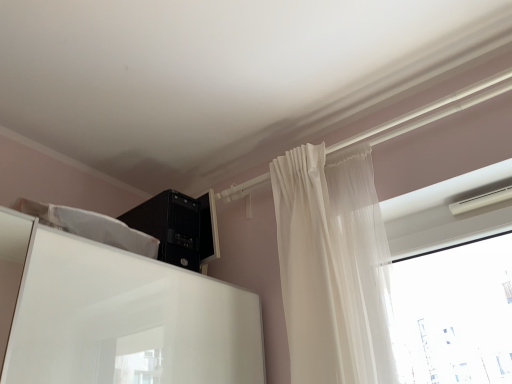
Question: Does black plastic computer tower at upper center appear on the right side of sheer white curtain at upper right?

Choices:
 (A) no
 (B) yes

Answer: (A)

Question: Is black plastic computer tower at upper center touching sheer white curtain at upper right?

Choices:
 (A) no
 (B) yes

Answer: (A)

Question: From the image's perspective, is black plastic computer tower at upper center above sheer white curtain at upper right?

Choices:
 (A) no
 (B) yes

Answer: (B)

Question: Considering the relative positions of black plastic computer tower at upper center and sheer white curtain at upper right in the image provided, is black plastic computer tower at upper center in front of sheer white curtain at upper right?

Choices:
 (A) yes
 (B) no

Answer: (B)

Question: From a real-world perspective, is black plastic computer tower at upper center below sheer white curtain at upper right?

Choices:
 (A) no
 (B) yes

Answer: (A)

Question: Is black plastic computer tower at upper center facing away from sheer white curtain at upper right?

Choices:
 (A) no
 (B) yes

Answer: (A)

Question: Could you tell me if sheer white curtain at upper right is facing black plastic computer tower at upper center?

Choices:
 (A) no
 (B) yes

Answer: (A)

Question: Are sheer white curtain at upper right and black plastic computer tower at upper center located far from each other?

Choices:
 (A) yes
 (B) no

Answer: (B)

Question: Can black plastic computer tower at upper center be found inside sheer white curtain at upper right?

Choices:
 (A) no
 (B) yes

Answer: (A)

Question: Does sheer white curtain at upper right come behind black plastic computer tower at upper center?

Choices:
 (A) no
 (B) yes

Answer: (A)

Question: From a real-world perspective, is sheer white curtain at upper right located beneath black plastic computer tower at upper center?

Choices:
 (A) yes
 (B) no

Answer: (A)

Question: Considering the relative sizes of sheer white curtain at upper right and black plastic computer tower at upper center in the image provided, is sheer white curtain at upper right smaller than black plastic computer tower at upper center?

Choices:
 (A) no
 (B) yes

Answer: (A)

Question: Do you think black plastic computer tower at upper center is within sheer white curtain at upper right, or outside of it?

Choices:
 (A) inside
 (B) outside

Answer: (B)